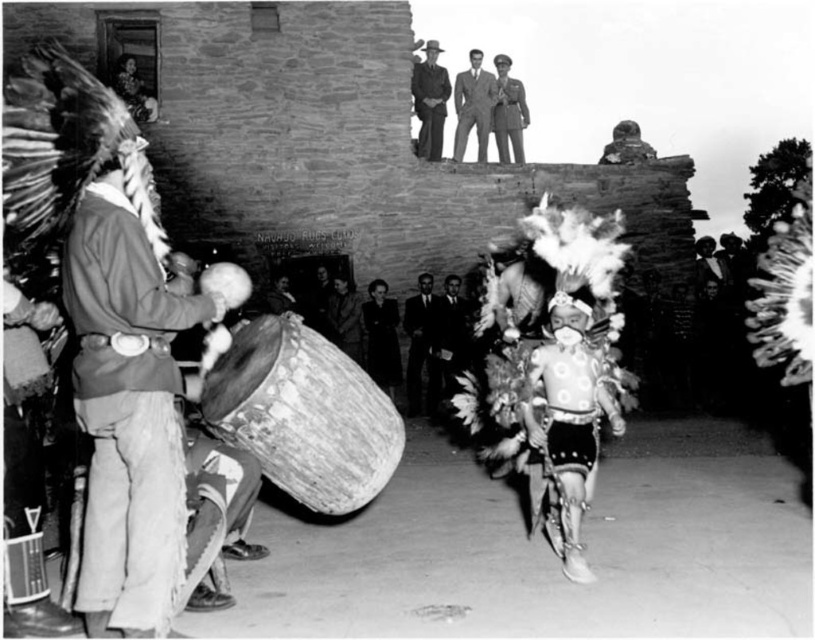
Question: Does leather jacket at left come behind smooth black suit at center?

Choices:
 (A) yes
 (B) no

Answer: (B)

Question: Can you confirm if smooth black suit at center is bigger than dark suit at center?

Choices:
 (A) yes
 (B) no

Answer: (A)

Question: Which point appears farthest from the camera in this image?

Choices:
 (A) (335, 332)
 (B) (134, 428)

Answer: (A)

Question: Which point is farther from the camera taking this photo?

Choices:
 (A) tap(443, 296)
 (B) tap(346, 314)
 (C) tap(252, 426)

Answer: (A)

Question: Where is smooth suit at upper center located in relation to smooth leather jacket at upper center in the image?

Choices:
 (A) right
 (B) left

Answer: (B)

Question: Which of the following is the closest to the observer?

Choices:
 (A) smooth leather jacket at center
 (B) smooth suit at upper center
 (C) dark wool coat at center
 (D) dark suit at center

Answer: (C)